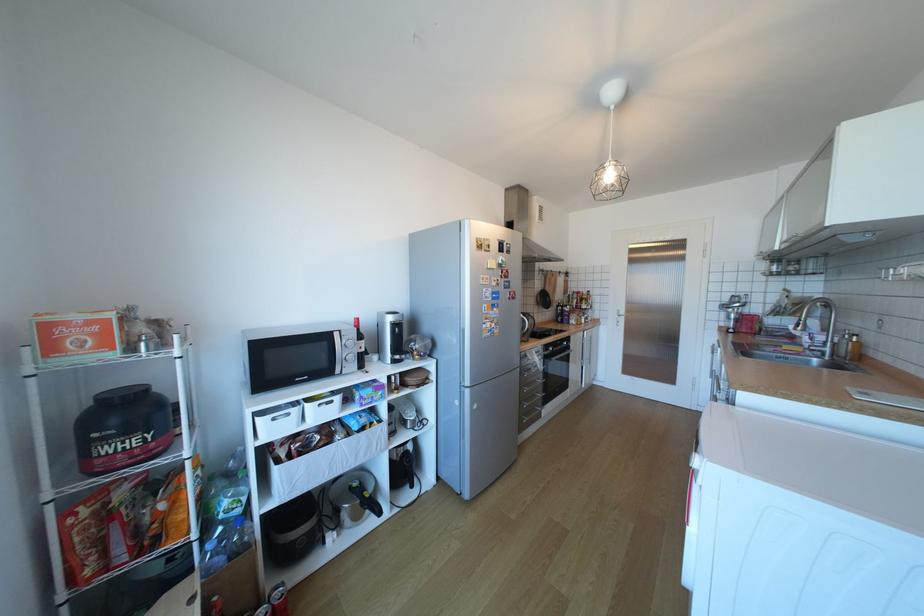
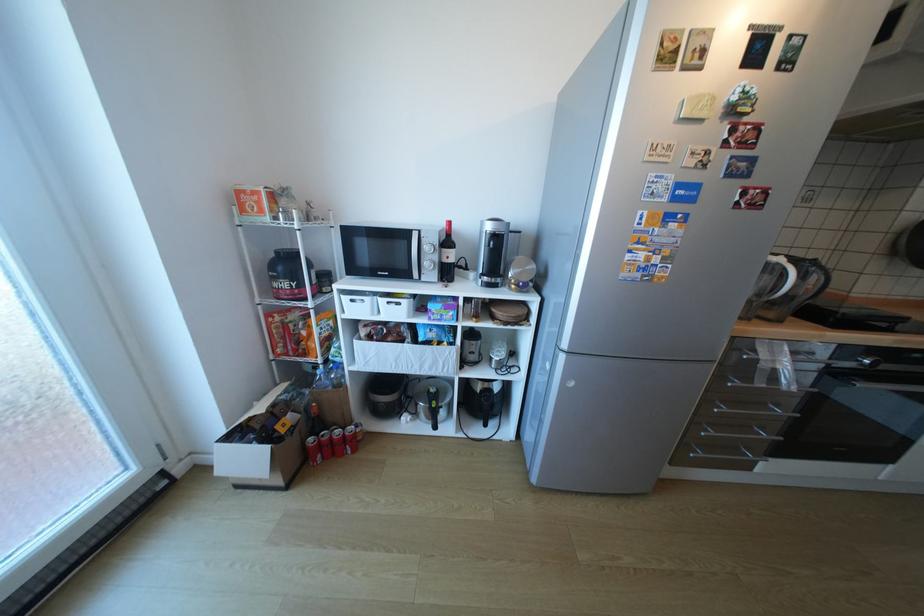
The images are taken continuously from a first-person perspective. In which direction is your viewpoint rotating?

The camera's rotation is toward left-down.